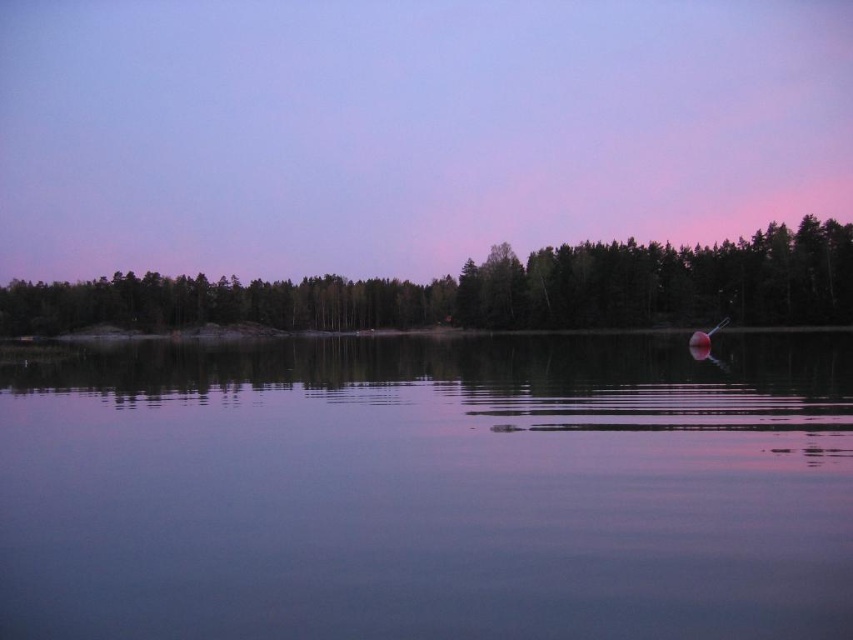
Which of these two, purple sky at upper center or green matte tree at center, stands taller?

purple sky at upper center is taller.

Which is behind, point (676, 148) or point (436, 300)?

Point (676, 148)

Find the location of `purple sky at upper center`. purple sky at upper center is located at coordinates (407, 129).

Who is taller, transparent water at center or purple sky at upper center?

purple sky at upper center

Does transparent water at center have a smaller size compared to purple sky at upper center?

Correct, transparent water at center occupies less space than purple sky at upper center.

Who is more forward, (764, 548) or (695, 157)?

Positioned in front is point (764, 548).

Where is `transparent water at center`? transparent water at center is located at coordinates (431, 490).

Locate an element on the screen. This screenshot has width=853, height=640. transparent water at center is located at coordinates (431, 490).

Who is taller, transparent water at center or green matte tree at center?

green matte tree at center is taller.

Identify the location of transparent water at center. (431, 490).